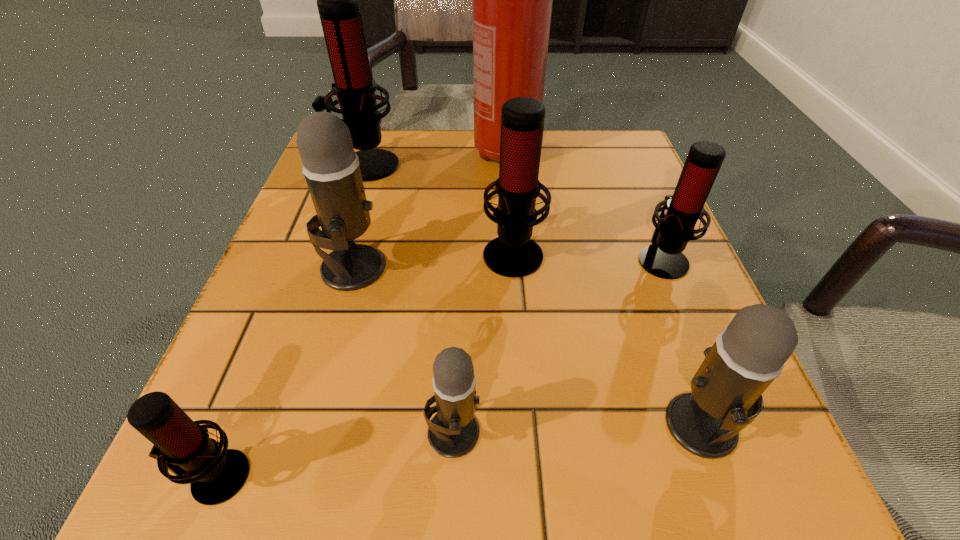
Select which object is the third closest to the second biggest red microphone. Please provide its 2D coordinates. Your answer should be formatted as a tuple, i.e. [(x, y)], where the tuple contains the x and y coordinates of a point satisfying the conditions above.

[(331, 168)]

Locate which microphone is the fifth closest to the third smallest red microphone. Please provide its 2D coordinates. Your answer should be formatted as a tuple, i.e. [(x, y)], where the tuple contains the x and y coordinates of a point satisfying the conditions above.

[(725, 397)]

Identify the location of the closest microphone to the fourth microphone from right to left. This screenshot has width=960, height=540. (181, 445).

This screenshot has width=960, height=540. Identify the location of red microphone that is the closest to the biggest gray microphone. (513, 254).

What are the coordinates of `red microphone that is the third closest to the second tallest object` in the screenshot? It's located at (181, 445).

Find the location of a particular element. This screenshot has width=960, height=540. gray microphone that is the closest to the rightmost red microphone is located at coordinates (725, 397).

You are a GUI agent. You are given a task and a screenshot of the screen. Output one action in this format:
    pyautogui.click(x=<x>, y=<y>)
    Task: Click on the gray microphone object that ranks as the closest to the second gray microphone from left to right
    
    Given the screenshot: What is the action you would take?
    pyautogui.click(x=331, y=168)

Locate an element on the screen. vacant space that satisfies the following two spatial constraints: 1. on the back side of the second gray microphone from right to left; 2. on the right side of the rightmost red microphone is located at coordinates (461, 259).

Identify the location of free spot that satisfies the following two spatial constraints: 1. on the back side of the rightmost gray microphone; 2. on the left side of the second smallest red microphone. This screenshot has height=540, width=960. (640, 259).

Image resolution: width=960 pixels, height=540 pixels. I want to click on blank area in the image that satisfies the following two spatial constraints: 1. on the back side of the third microphone from right to left; 2. on the right side of the farthest gray microphone, so click(357, 252).